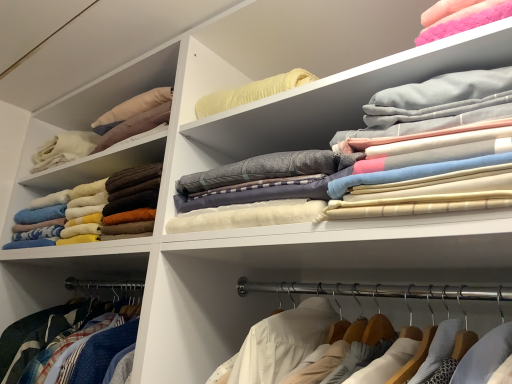
Where is `soft cotton sheets at upper right, which ranks as the second clothing in left-to-right order`? soft cotton sheets at upper right, which ranks as the second clothing in left-to-right order is located at coordinates (393, 158).

What do you see at coordinates (393, 158) in the screenshot? I see `soft cotton sheets at upper right, the 2th clothing viewed from the back` at bounding box center [393, 158].

Measure the distance between point (112,203) and camera.

The depth of point (112,203) is 3.73 feet.

In order to click on fluffy brown blanket at left, which ranks as the 1th clothing in left-to-right order in this screenshot , I will do `click(102, 207)`.

What do you see at coordinates (102, 207) in the screenshot?
I see `fluffy brown blanket at left, the 1th clothing viewed from the back` at bounding box center [102, 207].

What is the approximate height of fluffy brown blanket at left, the 2th clothing in the front-to-back sequence?

16.66 centimeters.

Locate an element on the screen. The image size is (512, 384). soft cotton sheets at upper right, the first clothing in the right-to-left sequence is located at coordinates (393, 158).

Between fluffy brown blanket at left, the 1th clothing viewed from the back, and soft cotton sheets at upper right, which ranks as the second clothing in left-to-right order, which one appears on the left side from the viewer's perspective?

fluffy brown blanket at left, the 1th clothing viewed from the back, is more to the left.

Looking at this image, considering the positions of objects fluffy brown blanket at left, the 2th clothing in the front-to-back sequence, and soft cotton sheets at upper right, the first clothing in the right-to-left sequence, in the image provided, who is in front, fluffy brown blanket at left, the 2th clothing in the front-to-back sequence, or soft cotton sheets at upper right, the first clothing in the right-to-left sequence,?

soft cotton sheets at upper right, the first clothing in the right-to-left sequence, is in front.

Is point (112, 195) closer or farther from the camera than point (186, 213)?

Point (112, 195) is positioned farther from the camera compared to point (186, 213).

From the image's perspective, is fluffy brown blanket at left, the 1th clothing viewed from the back, located beneath soft cotton sheets at upper right, which ranks as the second clothing in left-to-right order?

Yes.

From a real-world perspective, which object rests below the other?

From a 3D spatial view, fluffy brown blanket at left, the 2th clothing positioned from the right, is below.

Does fluffy brown blanket at left, which ranks as the 1th clothing in left-to-right order, have a greater width compared to soft cotton sheets at upper right, the 2th clothing viewed from the back?

Indeed, fluffy brown blanket at left, which ranks as the 1th clothing in left-to-right order, has a greater width compared to soft cotton sheets at upper right, the 2th clothing viewed from the back.

In the scene shown: Between fluffy brown blanket at left, the 2th clothing in the front-to-back sequence, and soft cotton sheets at upper right, the 2th clothing viewed from the back, which one has less height?

Standing shorter between the two is fluffy brown blanket at left, the 2th clothing in the front-to-back sequence.

Does fluffy brown blanket at left, the 2th clothing positioned from the right, have a larger size compared to soft cotton sheets at upper right, the 2th clothing viewed from the back?

Correct, fluffy brown blanket at left, the 2th clothing positioned from the right, is larger in size than soft cotton sheets at upper right, the 2th clothing viewed from the back.

Is fluffy brown blanket at left, the 1th clothing viewed from the back, inside or outside of soft cotton sheets at upper right, the first clothing in the right-to-left sequence?

The correct answer is: outside.

Is fluffy brown blanket at left, the 1th clothing viewed from the back, with soft cotton sheets at upper right, which ranks as the second clothing in left-to-right order?

No, fluffy brown blanket at left, the 1th clothing viewed from the back, is not next to soft cotton sheets at upper right, which ranks as the second clothing in left-to-right order.

Is fluffy brown blanket at left, the 1th clothing viewed from the back, facing towards soft cotton sheets at upper right, which is the first clothing in front-to-back order?

No, fluffy brown blanket at left, the 1th clothing viewed from the back, is not turned towards soft cotton sheets at upper right, which is the first clothing in front-to-back order.

Can you tell me how much fluffy brown blanket at left, the 2th clothing positioned from the right, and soft cotton sheets at upper right, which ranks as the second clothing in left-to-right order, differ in facing direction?

They differ by 6.51 degrees in their facing directions.

Measure the distance from fluffy brown blanket at left, the 2th clothing in the front-to-back sequence, to soft cotton sheets at upper right, the first clothing in the right-to-left sequence.

45.71 centimeters.

The width and height of the screenshot is (512, 384). Identify the location of clothing that is on the left side of soft cotton sheets at upper right, which ranks as the second clothing in left-to-right order. (102, 207).

From the picture: Considering the relative positions of soft cotton sheets at upper right, the first clothing in the right-to-left sequence, and fluffy brown blanket at left, the 1th clothing viewed from the back, in the image provided, is soft cotton sheets at upper right, the first clothing in the right-to-left sequence, to the left of fluffy brown blanket at left, the 1th clothing viewed from the back, from the viewer's perspective?

No.

Between soft cotton sheets at upper right, the 2th clothing viewed from the back, and fluffy brown blanket at left, the 1th clothing viewed from the back, which one is positioned in front?

soft cotton sheets at upper right, the 2th clothing viewed from the back, is more forward.

Does point (407, 107) lie behind point (154, 208)?

No, it is in front of (154, 208).

From the image's perspective, which is above, soft cotton sheets at upper right, the first clothing in the right-to-left sequence, or fluffy brown blanket at left, the 1th clothing viewed from the back?

From the image's view, soft cotton sheets at upper right, the first clothing in the right-to-left sequence, is above.

From a real-world perspective, who is located higher, soft cotton sheets at upper right, the first clothing in the right-to-left sequence, or fluffy brown blanket at left, which ranks as the 1th clothing in left-to-right order?

From a 3D spatial view, soft cotton sheets at upper right, the first clothing in the right-to-left sequence, is above.

Considering the sizes of objects soft cotton sheets at upper right, the first clothing in the right-to-left sequence, and fluffy brown blanket at left, the 2th clothing in the front-to-back sequence, in the image provided, who is wider, soft cotton sheets at upper right, the first clothing in the right-to-left sequence, or fluffy brown blanket at left, the 2th clothing in the front-to-back sequence,?

Wider between the two is fluffy brown blanket at left, the 2th clothing in the front-to-back sequence.

Who is shorter, soft cotton sheets at upper right, which is the first clothing in front-to-back order, or fluffy brown blanket at left, the 2th clothing in the front-to-back sequence?

With less height is fluffy brown blanket at left, the 2th clothing in the front-to-back sequence.

Is soft cotton sheets at upper right, the first clothing in the right-to-left sequence, bigger than fluffy brown blanket at left, the 2th clothing in the front-to-back sequence?

No, soft cotton sheets at upper right, the first clothing in the right-to-left sequence, is not bigger than fluffy brown blanket at left, the 2th clothing in the front-to-back sequence.

Is soft cotton sheets at upper right, which ranks as the second clothing in left-to-right order, not within fluffy brown blanket at left, the 1th clothing viewed from the back?

soft cotton sheets at upper right, which ranks as the second clothing in left-to-right order, is positioned outside fluffy brown blanket at left, the 1th clothing viewed from the back.

Is soft cotton sheets at upper right, which is the first clothing in front-to-back order, not near fluffy brown blanket at left, which ranks as the 1th clothing in left-to-right order?

No, there isn't a large distance between soft cotton sheets at upper right, which is the first clothing in front-to-back order, and fluffy brown blanket at left, which ranks as the 1th clothing in left-to-right order.

Is soft cotton sheets at upper right, which ranks as the second clothing in left-to-right order, turned away from fluffy brown blanket at left, the 2th clothing positioned from the right?

soft cotton sheets at upper right, which ranks as the second clothing in left-to-right order, is not turned away from fluffy brown blanket at left, the 2th clothing positioned from the right.

Measure the distance from soft cotton sheets at upper right, which is the first clothing in front-to-back order, to fluffy brown blanket at left, the 1th clothing viewed from the back.

They are 18.00 inches apart.

Find the location of a particular element. The width and height of the screenshot is (512, 384). clothing in front of the fluffy brown blanket at left, the 2th clothing in the front-to-back sequence is located at coordinates (393, 158).

This screenshot has width=512, height=384. Find the location of `clothing on the left of soft cotton sheets at upper right, which ranks as the second clothing in left-to-right order`. clothing on the left of soft cotton sheets at upper right, which ranks as the second clothing in left-to-right order is located at coordinates (102, 207).

This screenshot has width=512, height=384. I want to click on clothing on the right of fluffy brown blanket at left, the 2th clothing in the front-to-back sequence, so click(393, 158).